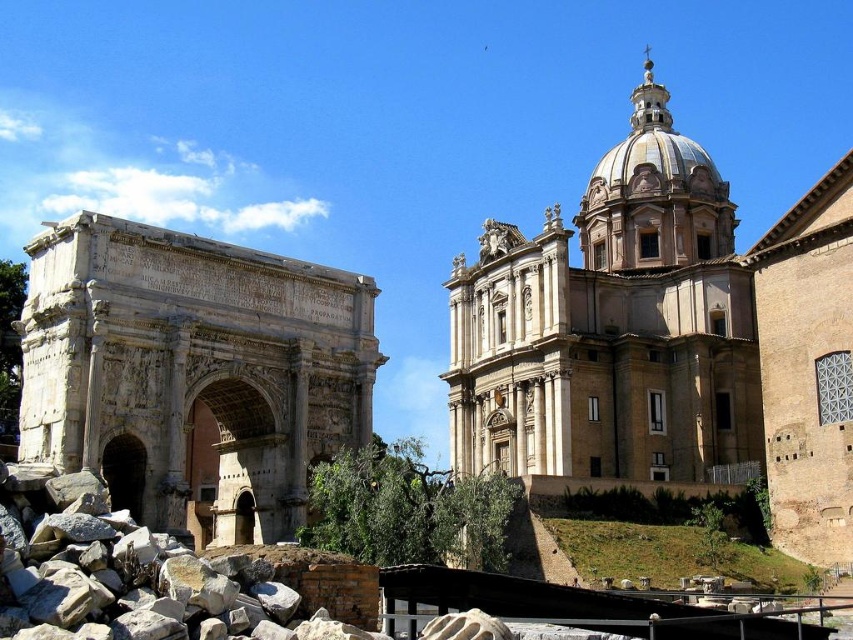
You are an architect visiting this site and want to take a photo that includes both the beige stone church at upper right and the carved stone arch at left. Given their sizes, which one should you focus on to ensure both are visible in the frame?

The beige stone church at upper right is larger in size than the carved stone arch at left, so you should focus on the beige stone church at upper right to ensure both structures are visible in the frame. By centering the camera on the church and adjusting the angle slightly towards the arch, both elements can fit within the shot.

Looking at this image, you are an architect analyzing the image. Which structure, the beige stone church at upper right or the carved stone arch at left, would require a taller crane for construction? Explain your reasoning based on their sizes.

The beige stone church at upper right requires a taller crane because it has a greater height compared to the carved stone arch at left.

You are an architect analyzing the spatial relationship between the beige stone church at upper right and the carved stone arch at left. Based on the scene, can you determine which structure has a greater width?

The beige stone church at upper right might be wider than carved stone arch at left according to the description.